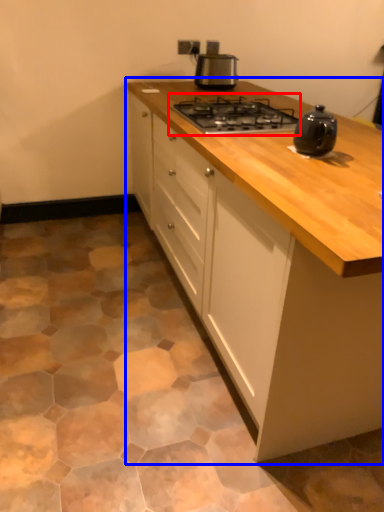
Question: Among these objects, which one is farthest to the camera, gas stove (highlighted by a red box) or cabinetry (highlighted by a blue box)?

Choices:
 (A) gas stove
 (B) cabinetry

Answer: (A)